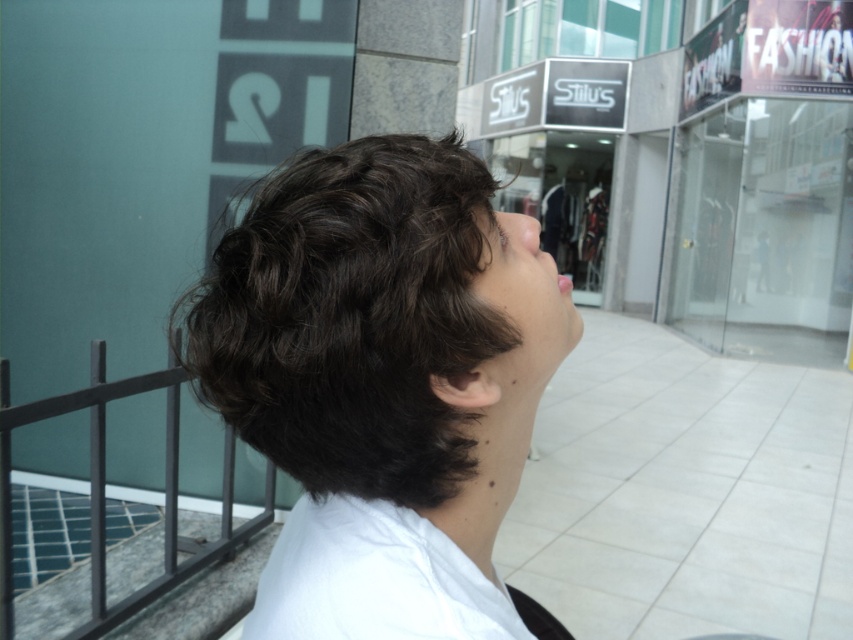
You are a delivery person who needs to place a package on the black metal balustrade at lower left. The package is 2 feet wide. Can you fit the package on the balustrade if you place it between the balustrade and the smooth skin face at center?

The distance between the black metal balustrade at lower left and the smooth skin face at center is 6.60 feet, which is more than enough to accommodate the 2 feet wide package. Yes, you can fit the package there.

You are standing in an urban shopping area and see the black metal balustrade at lower left and the smooth skin face at center. Which object is positioned to the left of the other?

The black metal balustrade at lower left is to the left of smooth skin face at center.